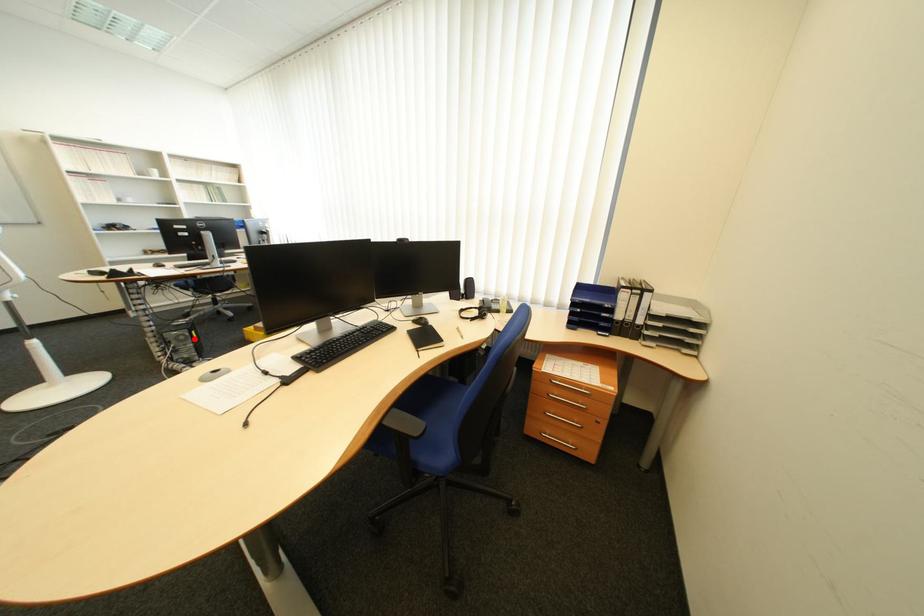
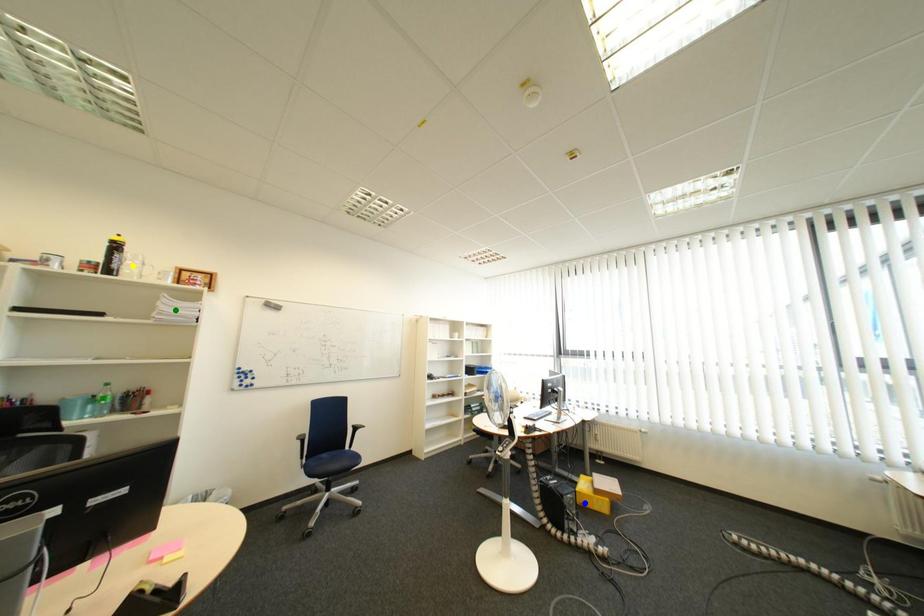
Question: I am providing you with two images of the same scene from different viewpoints. A red point is marked on the first image. You are given multiple points on the second image. Which point in image 2 represents the same 3d spot as the red point in image 1?

Choices:
 (A) blue point
 (B) yellow point
 (C) green point

Answer: (A)